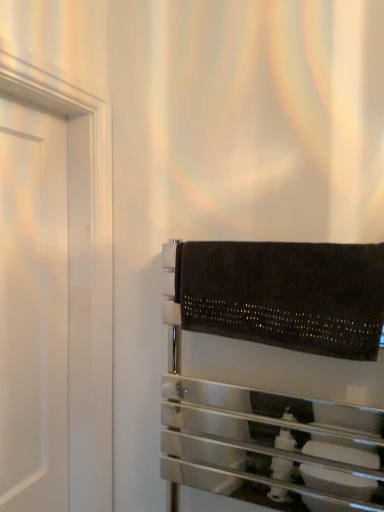
Question: Is black suede towel at lower right inside or outside of black textured towel rack at right?

Choices:
 (A) outside
 (B) inside

Answer: (B)

Question: Is black suede towel at lower right in front of or behind black textured towel rack at right in the image?

Choices:
 (A) behind
 (B) front

Answer: (A)

Question: From the image's perspective, relative to black textured towel rack at right, is black suede towel at lower right above or below?

Choices:
 (A) above
 (B) below

Answer: (A)

Question: Is black textured towel rack at right to the left or to the right of black suede towel at lower right in the image?

Choices:
 (A) right
 (B) left

Answer: (B)

Question: From a real-world perspective, is black textured towel rack at right above or below black suede towel at lower right?

Choices:
 (A) below
 (B) above

Answer: (A)

Question: Is black textured towel rack at right situated inside black suede towel at lower right or outside?

Choices:
 (A) outside
 (B) inside

Answer: (A)

Question: In terms of width, does black textured towel rack at right look wider or thinner when compared to black suede towel at lower right?

Choices:
 (A) thin
 (B) wide

Answer: (B)